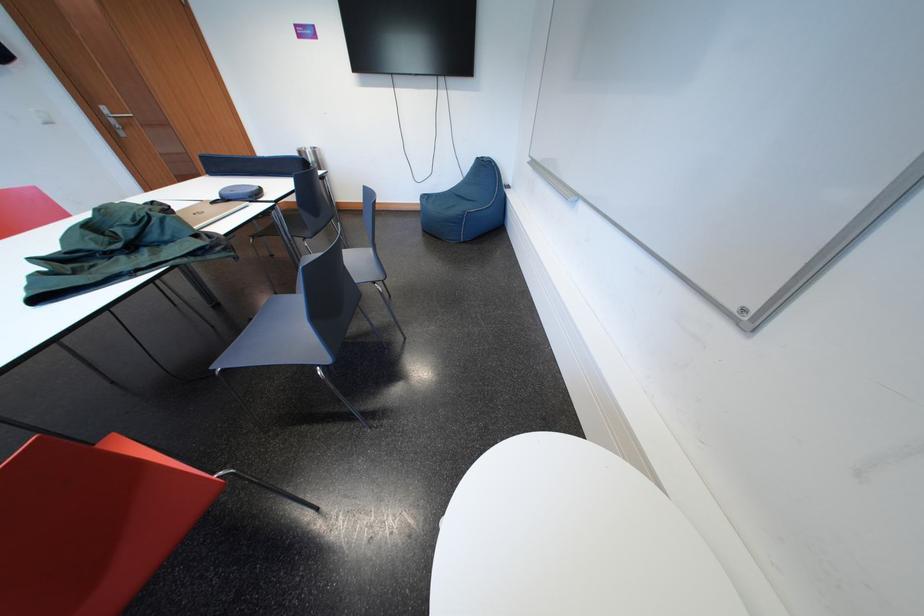
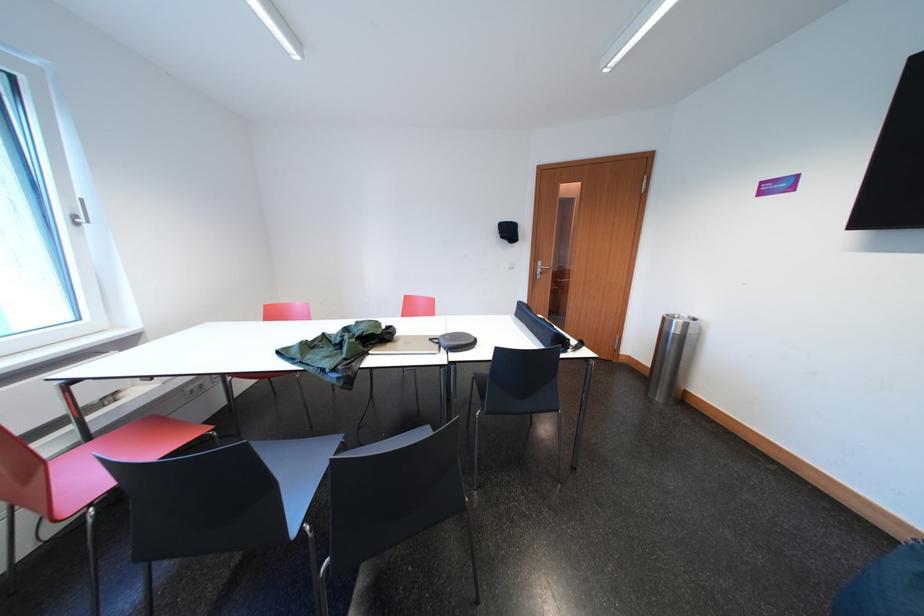
Where in the second image is the point corresponding to point (310, 158) from the first image?

(675, 325)